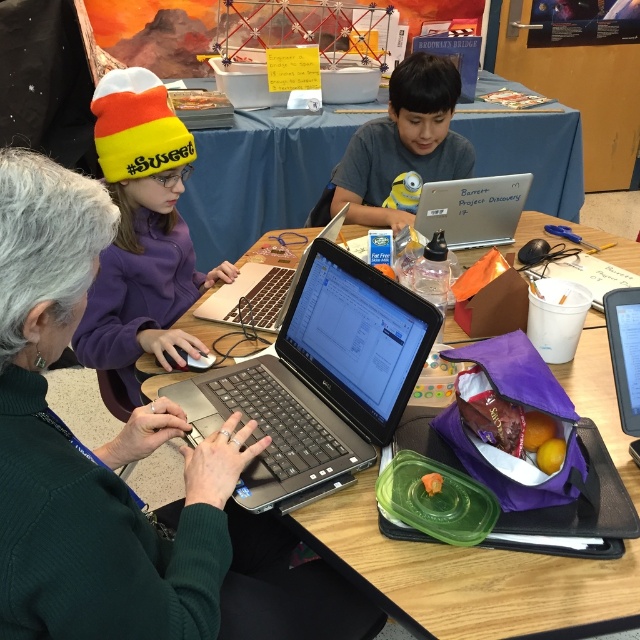
Which is behind, point (108, 579) or point (552, 576)?

Positioned behind is point (552, 576).

Does green ribbed sweater at center appear over black plastic laptop at center?

Incorrect, green ribbed sweater at center is not positioned above black plastic laptop at center.

Does point (220, 486) lie in front of point (612, 616)?

No, (220, 486) is further to viewer.

I want to click on green ribbed sweater at center, so click(116, 467).

Does point (268, 376) lie behind point (160, 275)?

No, it is in front of (160, 275).

Looking at this image, is black matte laptop at center further to the viewer compared to orange knit beanie at upper left?

That is False.

Is point (288, 392) positioned behind point (92, 346)?

No.

Where is `black matte laptop at center`? black matte laptop at center is located at coordinates (320, 378).

Is the position of orange knit beanie at upper left more distant than that of black glossy tablet at right?

Yes, it is behind black glossy tablet at right.

Who is more distant from viewer, (195,355) or (634,378)?

Positioned behind is point (195,355).

This screenshot has width=640, height=640. What are the coordinates of `orange knit beanie at upper left` in the screenshot? It's located at (141, 232).